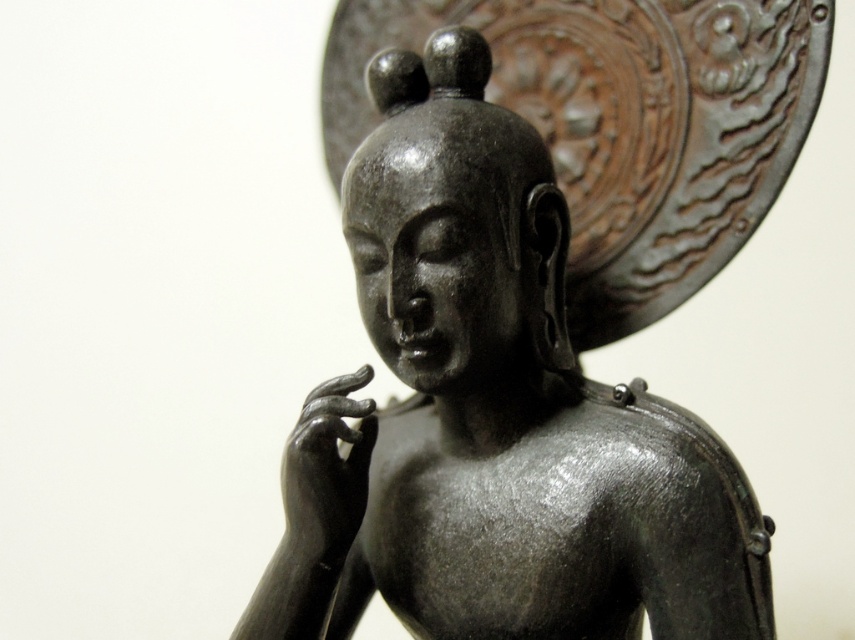
Does matte black statue at center have a larger size compared to matte black hand at center?

Correct, matte black statue at center is larger in size than matte black hand at center.

Is point (476, 356) behind point (310, 541)?

No, it is not.

Does point (457, 516) come farther from viewer compared to point (319, 400)?

Yes, point (457, 516) is farther from viewer.

The image size is (855, 640). Find the location of `matte black statue at center`. matte black statue at center is located at coordinates (493, 413).